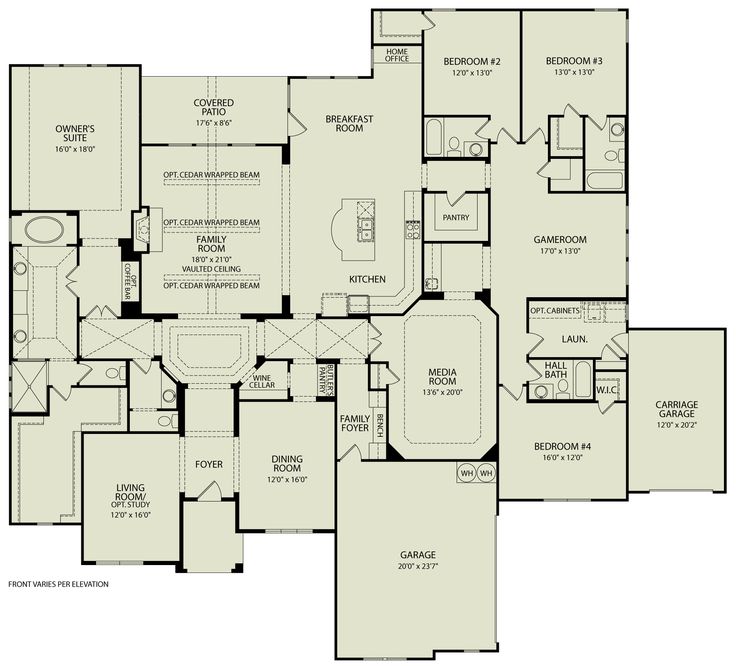
This screenshot has width=736, height=666. In order to click on closets in this screenshot , I will do `click(26, 475)`, `click(569, 129)`, `click(399, 30)`, `click(609, 386)`.